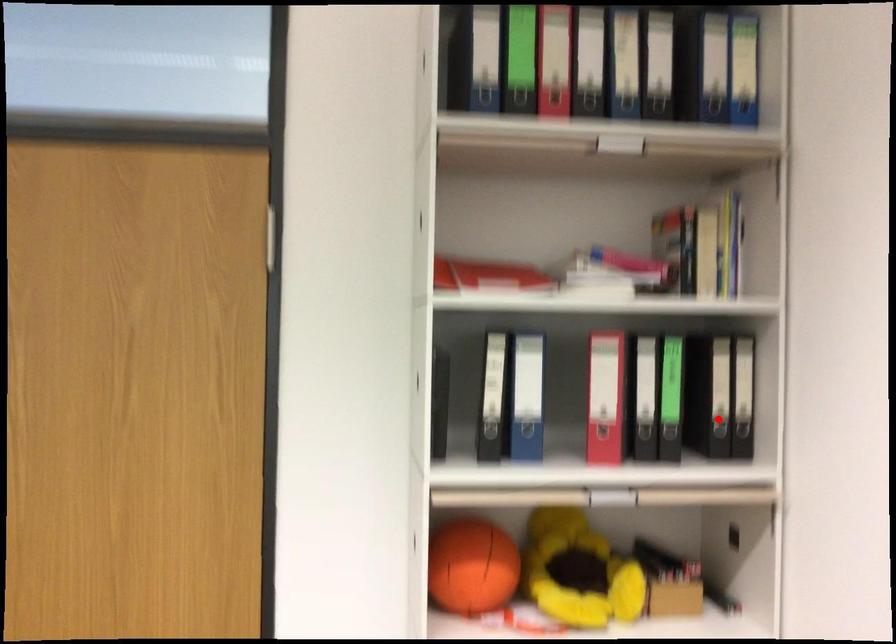
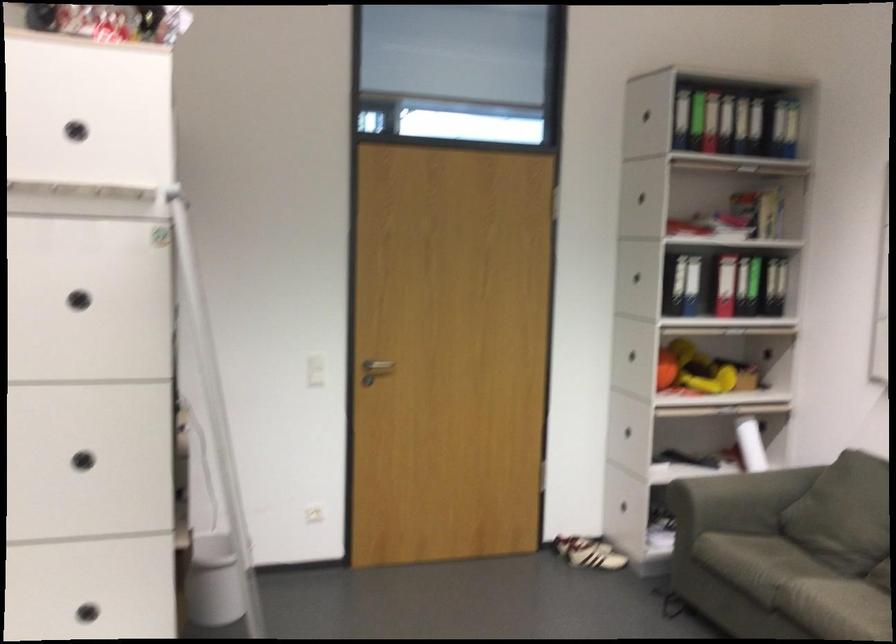
Question: I am providing you with two images of the same scene from different viewpoints. Image1 has a red point marked. In image2, the corresponding 3D location appears at what relative position? Reply with the corresponding letter.

Choices:
 (A) Closer
 (B) Farther

Answer: (B)